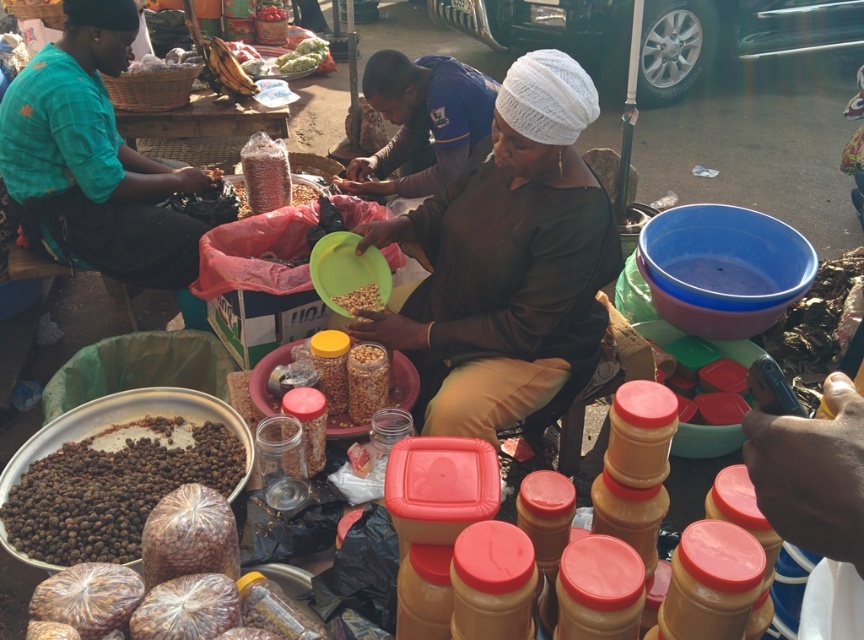
Question: Is dark brown matte seeds at lower left below brown matte grains at center?

Choices:
 (A) no
 (B) yes

Answer: (B)

Question: Which object is positioned closest to the green leafy vegetables at center?

Choices:
 (A) blue uniform shirt at center
 (B) brown matte grains at center
 (C) dark brown matte seeds at lower left
 (D) matte brown blouse at center

Answer: (A)

Question: Estimate the real-world distances between objects in this image. Which object is closer to the green leafy vegetables at center?

Choices:
 (A) blue uniform shirt at center
 (B) matte brown blouse at center

Answer: (A)

Question: Is dark brown matte seeds at lower left below brown matte grains at center?

Choices:
 (A) no
 (B) yes

Answer: (B)

Question: In this image, where is dark brown matte seeds at lower left located relative to green leafy vegetables at center?

Choices:
 (A) left
 (B) right

Answer: (B)

Question: Which object appears farthest from the camera in this image?

Choices:
 (A) green leafy vegetables at center
 (B) blue uniform shirt at center

Answer: (A)